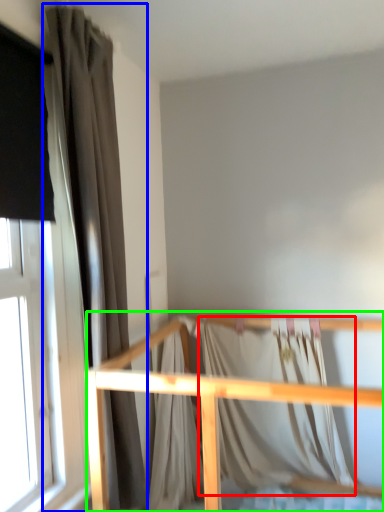
Question: Which is farther away from blanket (highlighted by a red box)? curtain (highlighted by a blue box) or rail (highlighted by a green box)?

Choices:
 (A) curtain
 (B) rail

Answer: (A)